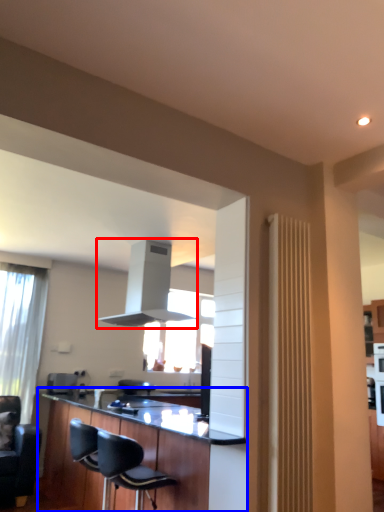
Question: Among these objects, which one is farthest to the camera, exhaust hood (highlighted by a red box) or cabinetry (highlighted by a blue box)?

Choices:
 (A) exhaust hood
 (B) cabinetry

Answer: (A)